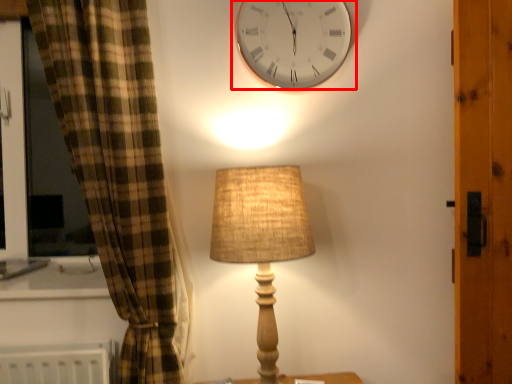
Question: In this image, where is wall clock (annotated by the red box) located relative to lamp?

Choices:
 (A) right
 (B) left

Answer: (A)